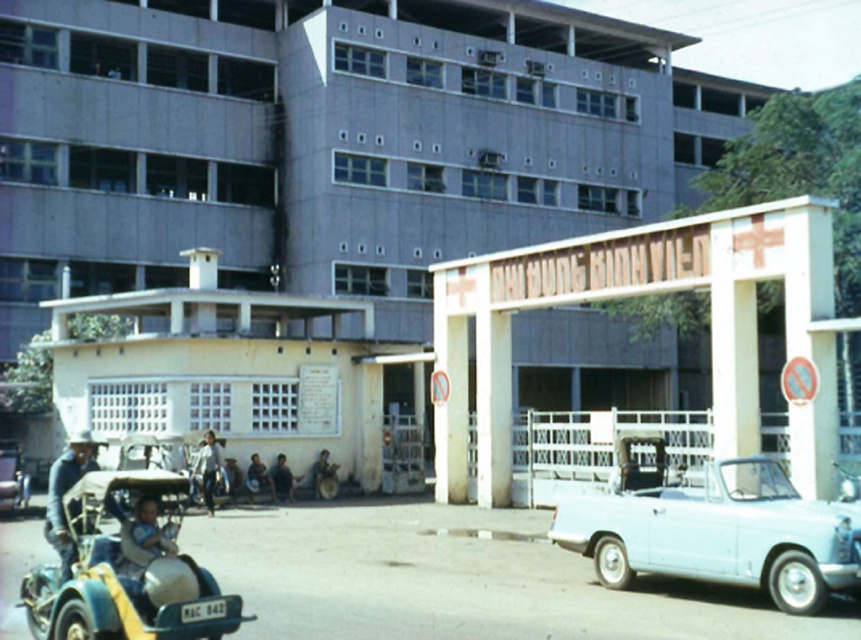
You are a visitor arriving at the hospital and need to park your car. You see a white glossy car at right and a metallic green car at lower left. Based on their positions, which parking spot is closer to the entrance gate?

The metallic green car at lower left is closer to the entrance gate because the white glossy car at right is located above it, meaning it is parked further back from the entrance.